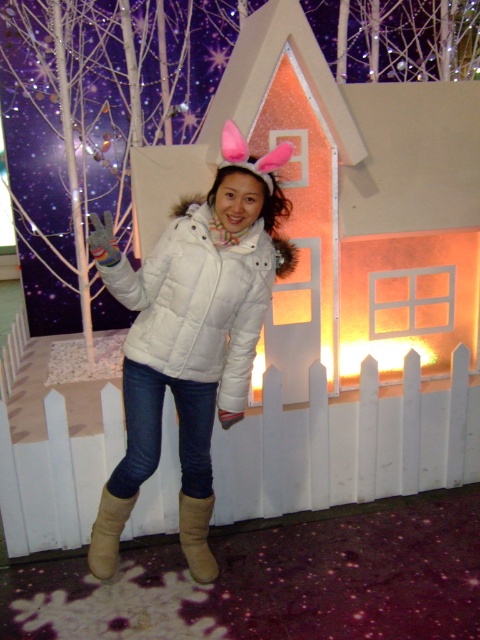
Question: Among these objects, which one is farthest from the camera?

Choices:
 (A) white puffy jacket at center
 (B) brown suede boot at lower center

Answer: (B)

Question: Which point is farther to the camera?

Choices:
 (A) (229, 164)
 (B) (289, 264)
 (C) (192, 547)

Answer: (C)

Question: Does brown suede boot at lower center have a smaller size compared to tan suede boot at lower center?

Choices:
 (A) no
 (B) yes

Answer: (A)

Question: Is white matte jacket at center thinner than tan suede boot at lower center?

Choices:
 (A) no
 (B) yes

Answer: (A)

Question: Which object is positioned farthest from the white matte jacket at center?

Choices:
 (A) tan suede boot at lower center
 (B) white puffy jacket at center

Answer: (A)

Question: In this image, where is white matte jacket at center located relative to white puffy jacket at center?

Choices:
 (A) right
 (B) left

Answer: (B)